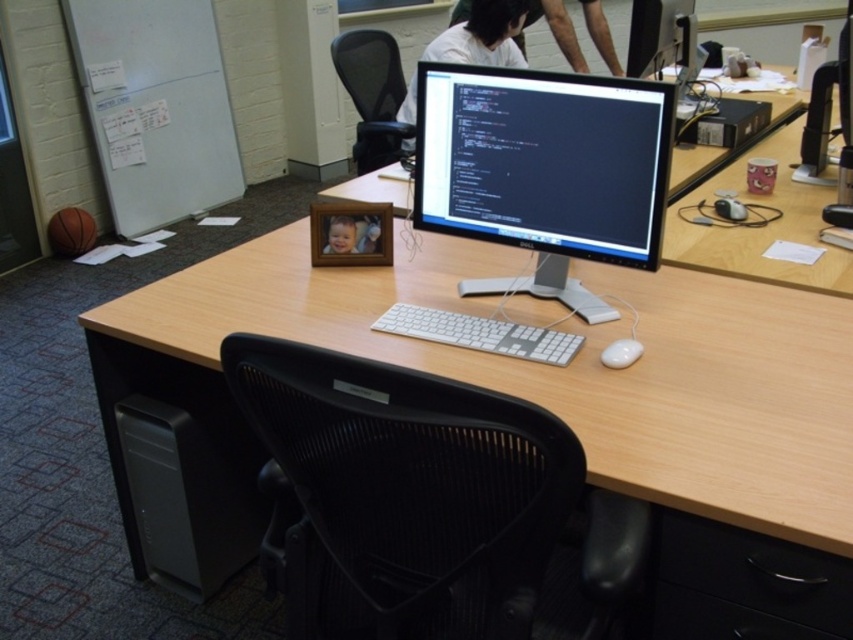
Question: Which point is farther to the camera?

Choices:
 (A) (503, 10)
 (B) (572, 228)
 (C) (714, 593)
 (D) (550, 355)

Answer: (A)

Question: Does satin black monitor at upper center appear under white glossy mouse at lower right?

Choices:
 (A) yes
 (B) no

Answer: (B)

Question: Which object is the closest to the black mesh swivel chair at center?

Choices:
 (A) white matte shirt at upper center
 (B) black plastic drawer at lower right
 (C) white plastic keyboard at center

Answer: (B)

Question: Which of these objects is positioned closest to the white matte shirt at upper center?

Choices:
 (A) white plastic keyboard at center
 (B) black mesh swivel chair at center

Answer: (A)

Question: Does black plastic drawer at lower right have a larger size compared to satin black monitor at upper center?

Choices:
 (A) no
 (B) yes

Answer: (A)

Question: Can you confirm if white matte shirt at upper center is bigger than satin black monitor at upper center?

Choices:
 (A) yes
 (B) no

Answer: (A)